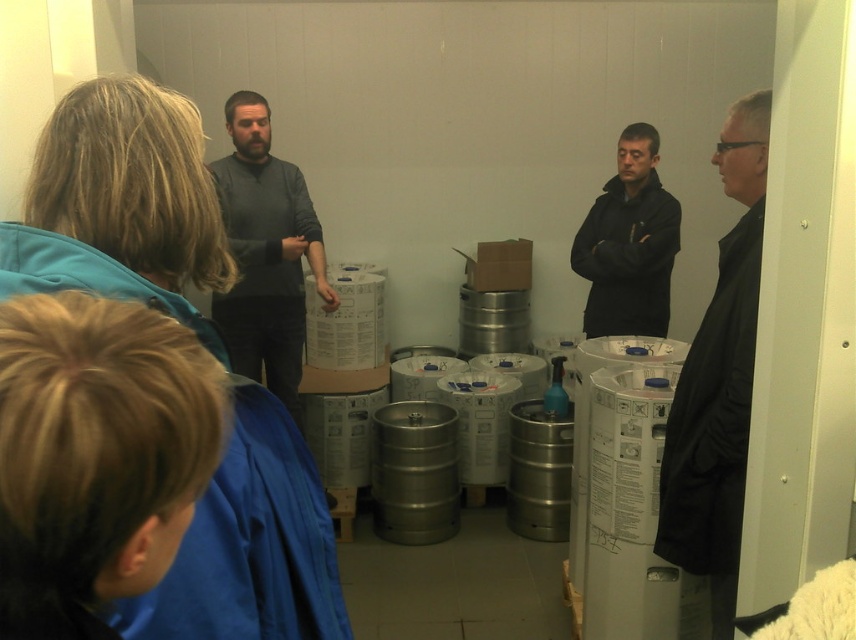
You are standing in the utility room and need to hand a tool to the person wearing the dark gray sweater at center and the black matte jacket at center. Since you can only reach one person at a time, which person should you hand the tool to first to ensure it reaches the other person without needing to move?

You should hand the tool to the dark gray sweater at center first because it is closer to the viewer than the black matte jacket at center, so they can pass it to the person behind them.

You are a delivery person carrying a 1.8 meter long box. You need to walk through the space between the black matte coat at right and the nearest wall. Is there enough space for the box to pass through?

Answer: The distance between the black matte coat at right and the nearest wall is 1.76 meters. Since the box is 1.8 meters long, it is slightly too long to fit through the space. You will need to find an alternative route or reposition the coat to create more space.

You are standing in the utility room and need to locate the dark gray sweater at center. According to the coordinates provided, where would you find it?

The dark gray sweater at center is located at the 2D coordinates point [265,252].